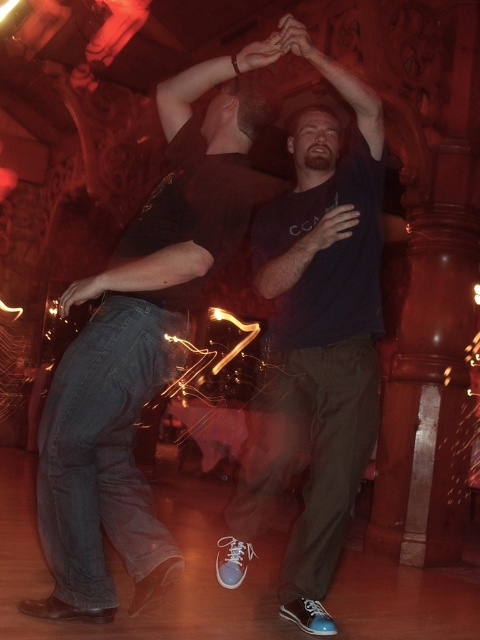
Based on the scene description, where is the jeans at left positioned in relation to the other elements in the image?

The jeans at left is located at point [134,371] in the image coordinates.